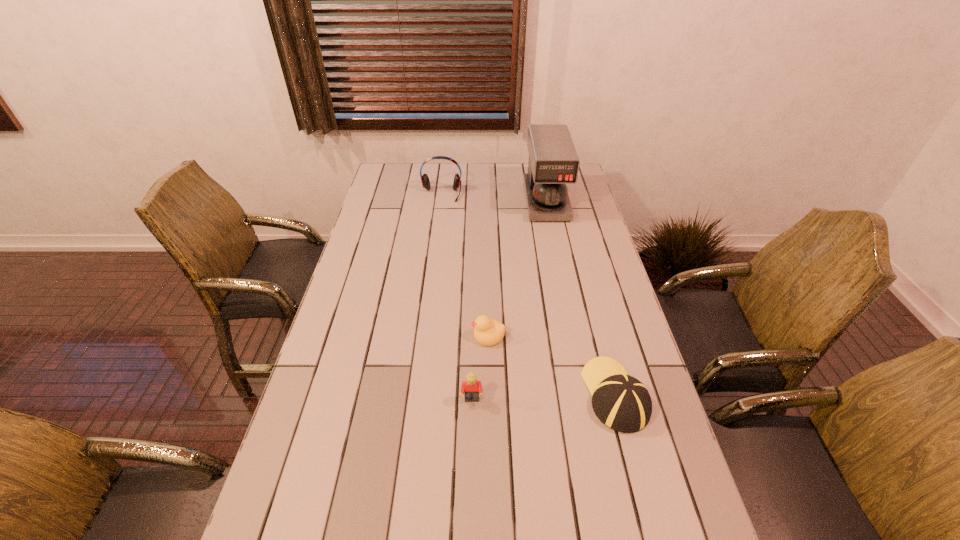
Find the location of a particular element. The width and height of the screenshot is (960, 540). object that stands as the fourth closest to the coffee maker is located at coordinates (471, 388).

The width and height of the screenshot is (960, 540). I want to click on free space that satisfies the following two spatial constraints: 1. with the brim of the baseball cap facing forward; 2. on the face of the shortest object, so click(600, 335).

Identify the location of blank area in the image that satisfies the following two spatial constraints: 1. on the face of the duckling; 2. on the face of the Lego. (490, 400).